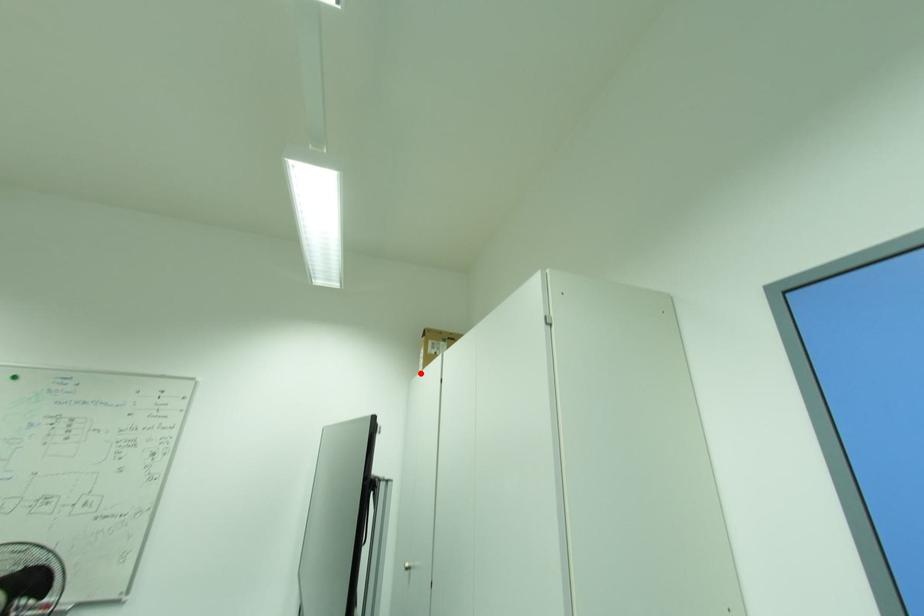
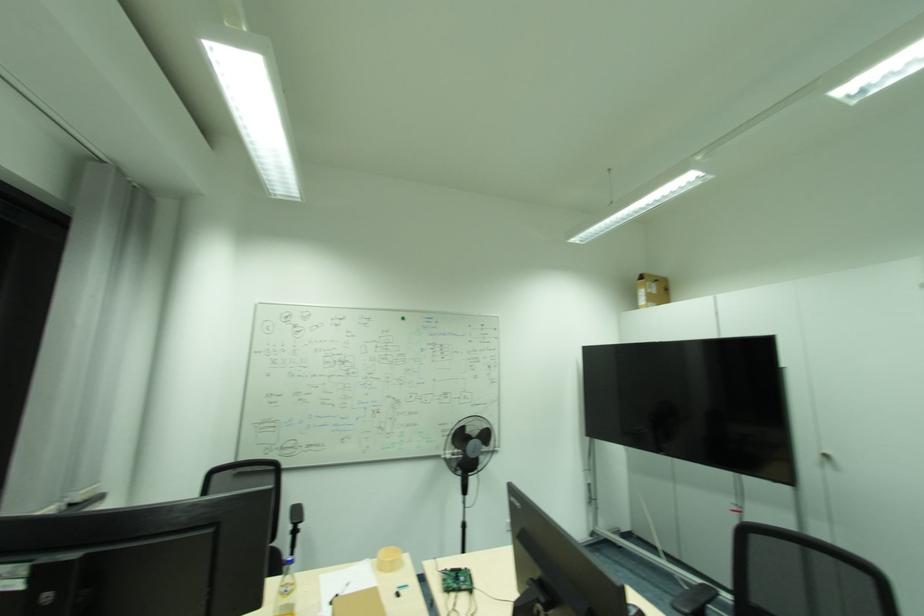
Question: I am providing you with two images of the same scene from different viewpoints. A red point is marked on the first image. At the location where the point appears in image 1, is it still visible in image 2?

Choices:
 (A) Yes
 (B) No

Answer: (A)